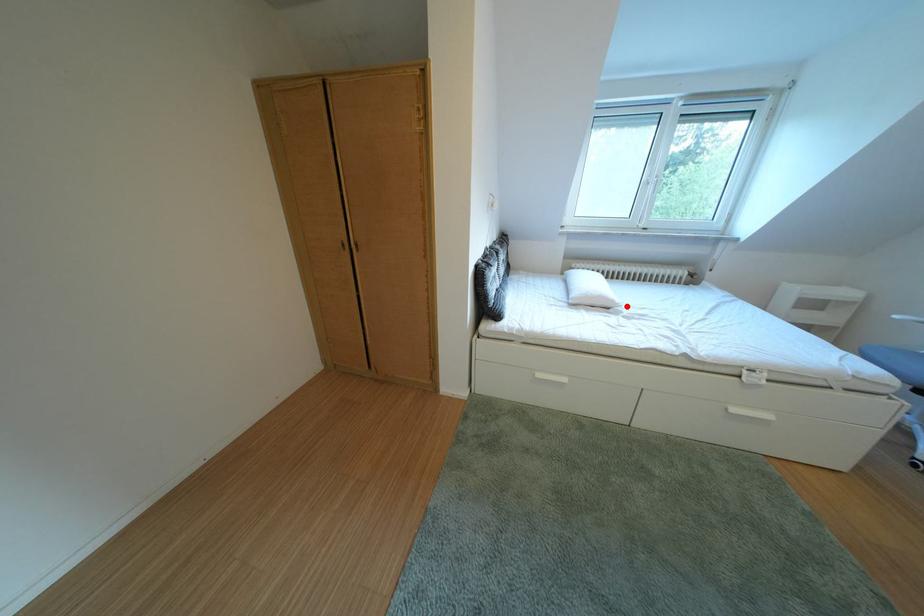
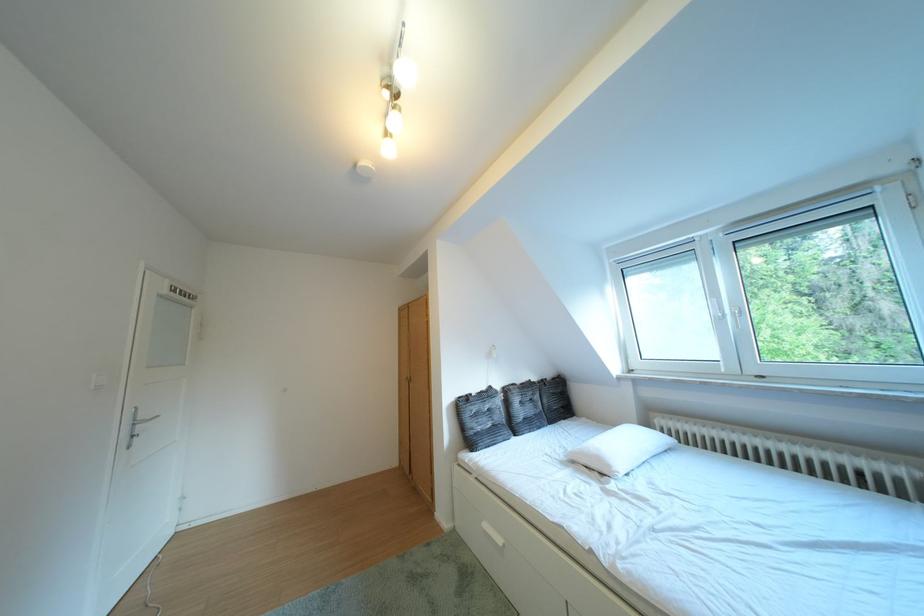
In the second image, find the point that corresponds to the highlighted location in the first image.

(623, 471)